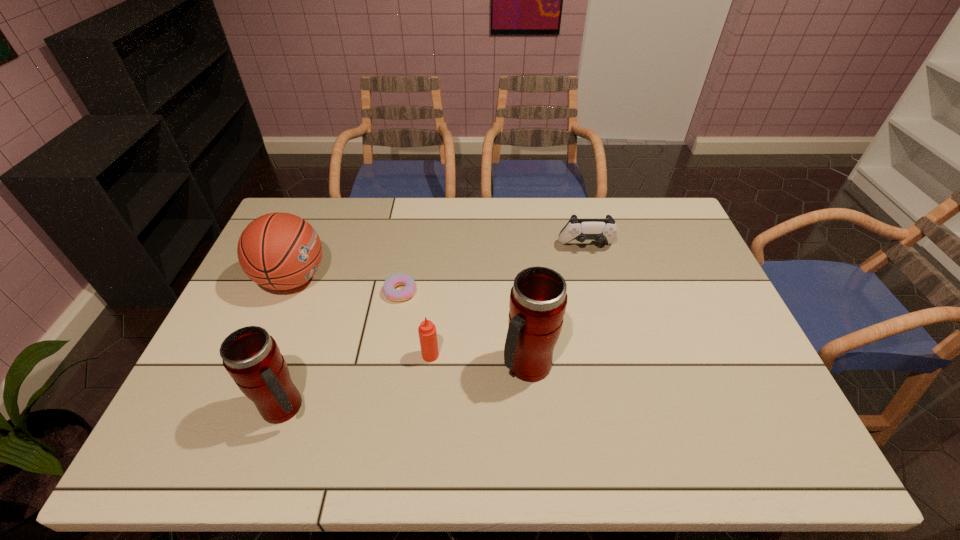
This screenshot has height=540, width=960. Identify the location of vacant point located 0.250m on the side with the handle of the shorter thermos bottle. (412, 408).

The height and width of the screenshot is (540, 960). I want to click on vacant space located on the left of the Tabasco sauce, so 348,355.

Locate an element on the screen. free location located 0.110m on the front-facing side of the control is located at coordinates (594, 278).

What are the coordinates of `vacant space situated on the back of the shortest object` in the screenshot? It's located at (414, 217).

Identify the location of vacant space situated 0.390m on the logo side of the basketball. This screenshot has width=960, height=540. (453, 279).

The width and height of the screenshot is (960, 540). Find the location of `object located in the left edge section of the desktop`. object located in the left edge section of the desktop is located at coordinates (280, 251).

I want to click on vacant space at the far edge of the desktop, so click(x=562, y=212).

This screenshot has height=540, width=960. Identify the location of free space at the near edge of the desktop. (603, 404).

Identify the location of free region at the left edge of the desktop. Image resolution: width=960 pixels, height=540 pixels. (236, 308).

At what (x,y) coordinates should I click in order to perform the action: click on vacant region at the far left corner of the desktop. Please return your answer as a coordinate pair (x, y). Looking at the image, I should click on (311, 198).